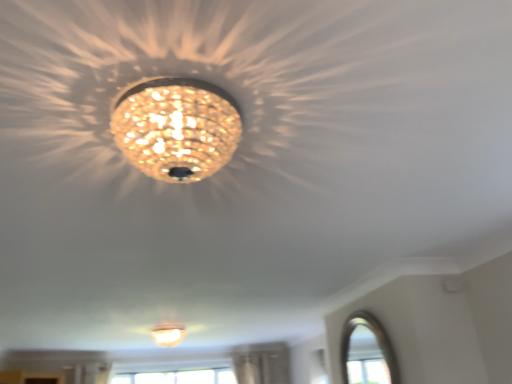
Question: Are matte white lampshade at center, arranged as the second lamp when viewed from the top, and matte gold chandelier at center, which appears as the 2th lamp when ordered from the bottom, making contact?

Choices:
 (A) no
 (B) yes

Answer: (A)

Question: Is matte white lampshade at center, which ranks as the 1th lamp in left-to-right order, at the right side of matte gold chandelier at center, which appears as the 2th lamp when ordered from the bottom?

Choices:
 (A) no
 (B) yes

Answer: (A)

Question: From the image's perspective, does matte white lampshade at center, the second lamp from the right, appear lower than matte gold chandelier at center, the first lamp positioned from the top?

Choices:
 (A) no
 (B) yes

Answer: (B)

Question: Is matte gold chandelier at center, positioned as the 1th lamp in right-to-left order, at the back of matte white lampshade at center, acting as the 2th lamp starting from the front?

Choices:
 (A) yes
 (B) no

Answer: (B)

Question: Considering the relative positions of matte white lampshade at center, which ranks as the 1th lamp in left-to-right order, and matte gold chandelier at center, positioned as the 1th lamp in right-to-left order, in the image provided, is matte white lampshade at center, which ranks as the 1th lamp in left-to-right order, behind matte gold chandelier at center, positioned as the 1th lamp in right-to-left order,?

Choices:
 (A) yes
 (B) no

Answer: (A)

Question: From a real-world perspective, is matte white lampshade at center, arranged as the second lamp when viewed from the top, below matte gold chandelier at center, which is the 2th lamp in back-to-front order?

Choices:
 (A) no
 (B) yes

Answer: (B)

Question: Is matte white lampshade at center, positioned as the 1th lamp in back-to-front order, at the right side of clear glass window at lower right?

Choices:
 (A) no
 (B) yes

Answer: (A)

Question: Is the surface of matte white lampshade at center, which ranks as the 1th lamp in left-to-right order, in direct contact with clear glass window at lower right?

Choices:
 (A) no
 (B) yes

Answer: (A)

Question: Does matte white lampshade at center, which ranks as the 1th lamp in left-to-right order, have a smaller size compared to clear glass window at lower right?

Choices:
 (A) yes
 (B) no

Answer: (B)

Question: Can you confirm if matte white lampshade at center, arranged as the second lamp when viewed from the top, is taller than clear glass window at lower right?

Choices:
 (A) no
 (B) yes

Answer: (A)

Question: From the image's perspective, is matte white lampshade at center, positioned as the first lamp in bottom-to-top order, under clear glass window at lower right?

Choices:
 (A) yes
 (B) no

Answer: (A)

Question: Does matte white lampshade at center, positioned as the first lamp in bottom-to-top order, have a larger size compared to clear glass window at lower right?

Choices:
 (A) no
 (B) yes

Answer: (B)

Question: From a real-world perspective, is matte gold chandelier at center, which appears as the 2th lamp when viewed from the left, physically above matte white lampshade at center, which ranks as the 1th lamp in left-to-right order?

Choices:
 (A) yes
 (B) no

Answer: (A)